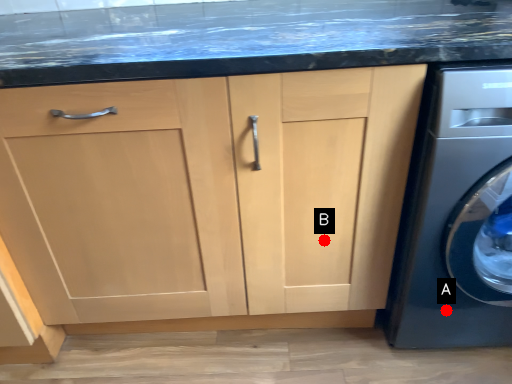
Question: Two points are circled on the image, labeled by A and B beside each circle. Which point appears closest to the camera in this image?

Choices:
 (A) A is closer
 (B) B is closer

Answer: (B)